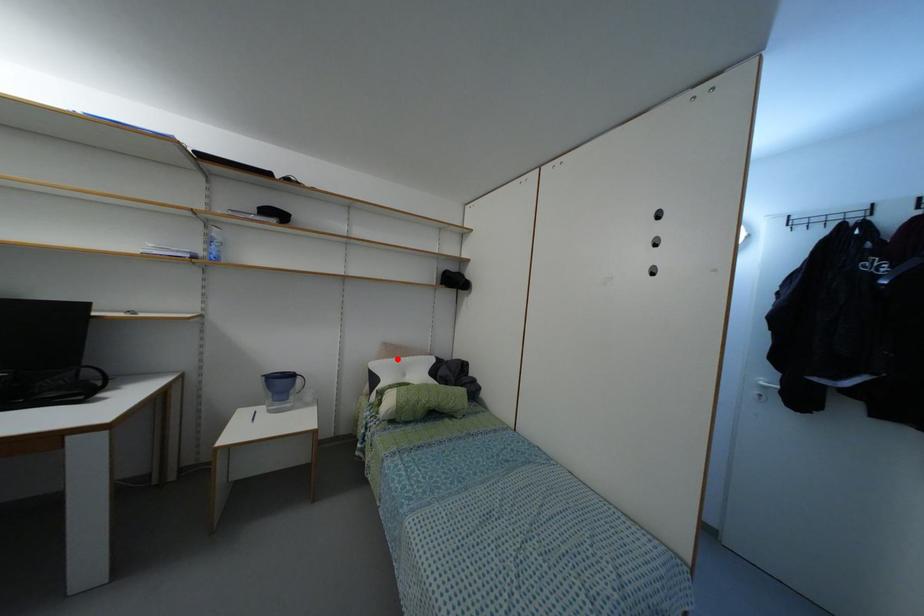
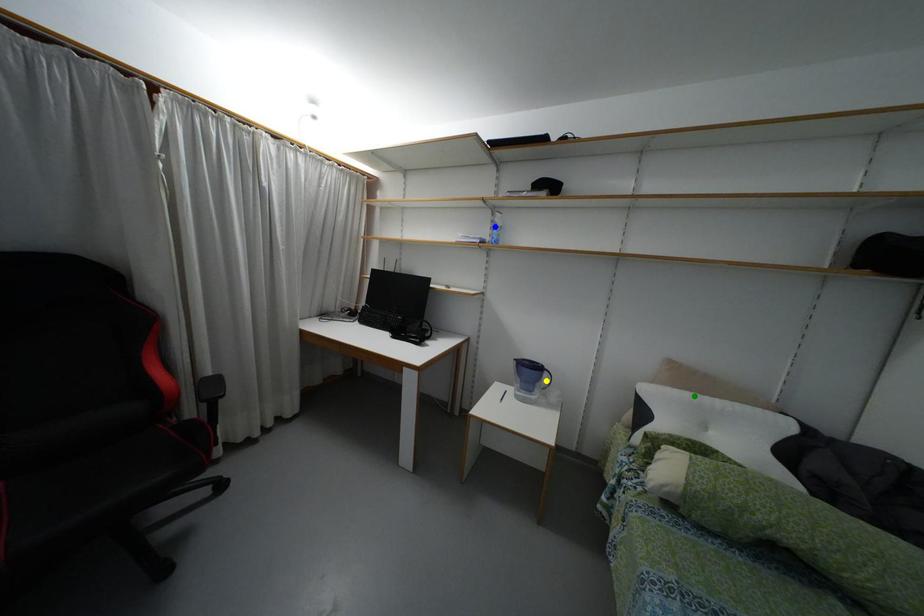
Question: I am providing you with two images of the same scene from different viewpoints. A red point is marked on the first image. You are given multiple points on the second image. Can you choose the point in image 2 that corresponds to the point in image 1?

Choices:
 (A) green point
 (B) blue point
 (C) yellow point

Answer: (A)